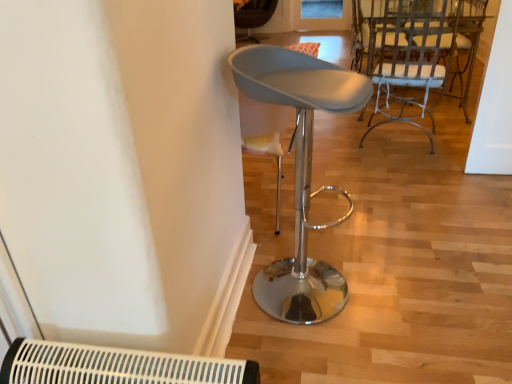
Image resolution: width=512 pixels, height=384 pixels. I want to click on free space in front of matte gray stool at center, the 1th chair in the front-to-back sequence, so click(x=322, y=351).